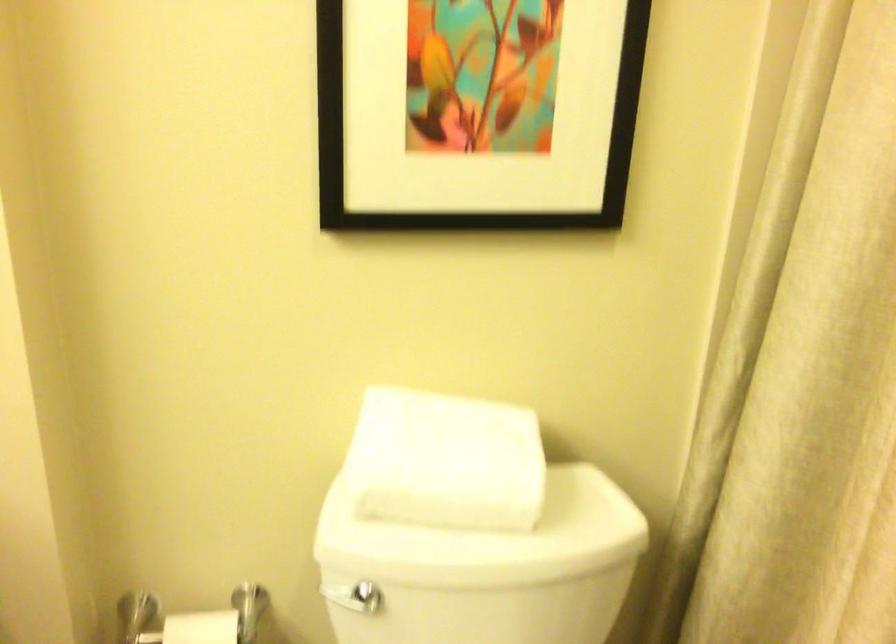
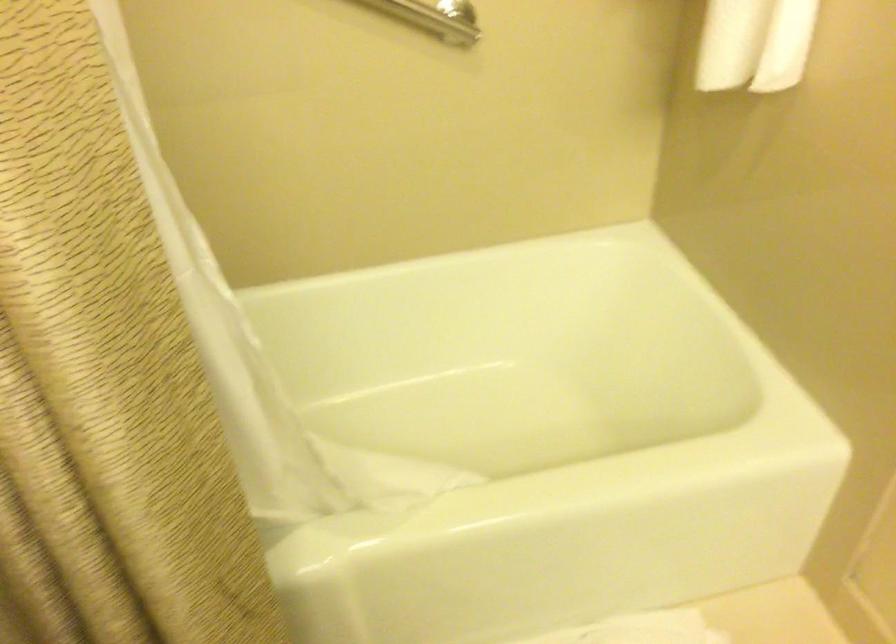
Based on the continuous images, in which direction is the camera rotating?

The camera's rotation is toward right-down.